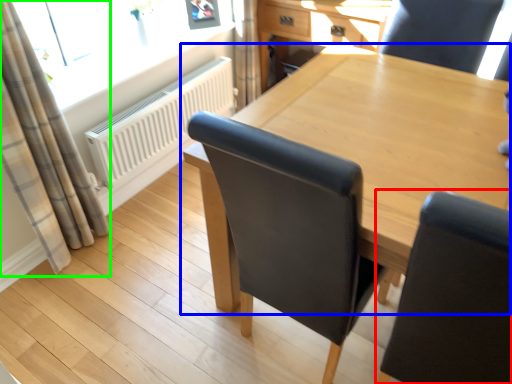
Question: Which object is the farthest from chair (highlighted by a red box)? Choose among these: table (highlighted by a blue box) or curtain (highlighted by a green box).

Choices:
 (A) table
 (B) curtain

Answer: (B)